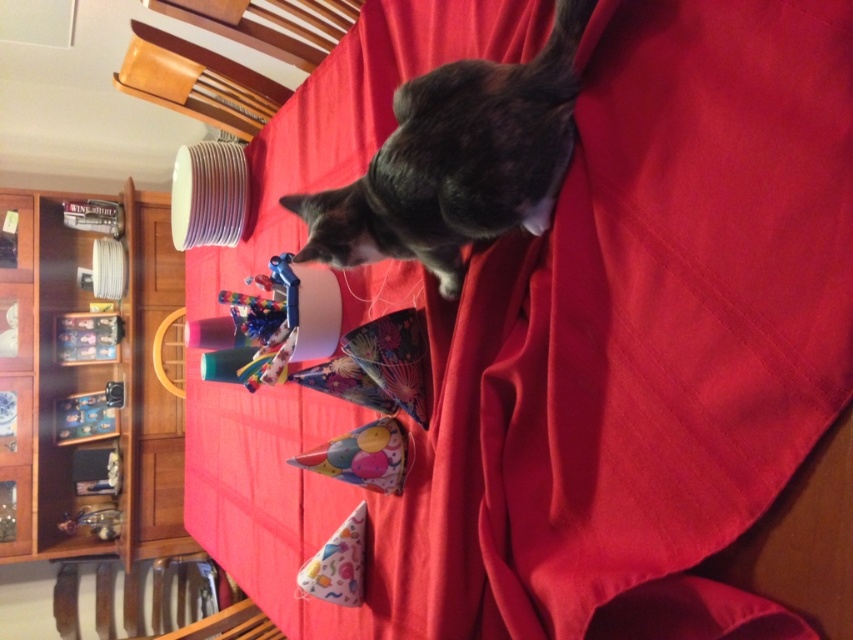
Who is positioned more to the right, multicolored paper party hat at center or patterned paper party hat at lower center?

multicolored paper party hat at center

Can you confirm if multicolored paper party hat at center is positioned to the right of patterned paper party hat at lower center?

Indeed, multicolored paper party hat at center is positioned on the right side of patterned paper party hat at lower center.

This screenshot has width=853, height=640. In order to click on multicolored paper party hat at center in this screenshot , I will do `click(363, 456)`.

I want to click on multicolored paper party hat at center, so click(x=363, y=456).

Consider the image. Who is positioned more to the left, dark gray fur cat at upper center or multicolored paper party hat at center?

Positioned to the left is multicolored paper party hat at center.

Image resolution: width=853 pixels, height=640 pixels. In order to click on dark gray fur cat at upper center in this screenshot , I will do `click(457, 161)`.

Who is shorter, patterned paper party hat at lower center or metallic silver toy at lower left?

metallic silver toy at lower left

Image resolution: width=853 pixels, height=640 pixels. Identify the location of patterned paper party hat at lower center. (337, 564).

Who is more forward, (345, 605) or (100, 509)?

Point (345, 605) is in front.

Find the location of a particular element. This screenshot has width=853, height=640. patterned paper party hat at lower center is located at coordinates click(x=337, y=564).